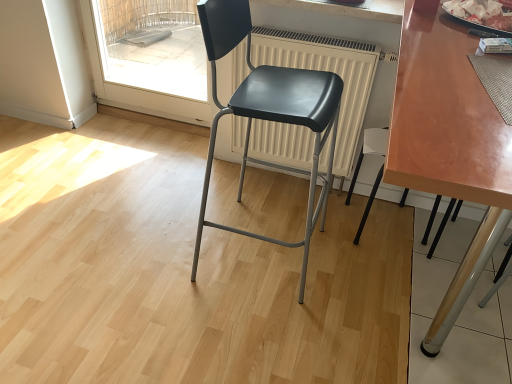
Question: Is matte black chair at center, which is the 1th chair in left-to-right order, at the back of matte black chair at lower right, which appears as the 2th chair when viewed from the left?

Choices:
 (A) no
 (B) yes

Answer: (A)

Question: Is matte black chair at lower right, which appears as the 2th chair when viewed from the left, bigger than matte black chair at center, which is the 1th chair in left-to-right order?

Choices:
 (A) yes
 (B) no

Answer: (B)

Question: Is matte black chair at lower right, marked as the 1th chair in a right-to-left arrangement, in contact with matte black chair at center, which is the 1th chair in left-to-right order?

Choices:
 (A) yes
 (B) no

Answer: (B)

Question: Is matte black chair at lower right, which appears as the 2th chair when viewed from the left, aimed at matte black chair at center, the second chair when ordered from right to left?

Choices:
 (A) yes
 (B) no

Answer: (B)

Question: From the image's perspective, is matte black chair at lower right, marked as the 1th chair in a right-to-left arrangement, below matte black chair at center, the second chair when ordered from right to left?

Choices:
 (A) no
 (B) yes

Answer: (B)

Question: Is matte black chair at lower right, marked as the 1th chair in a right-to-left arrangement, completely or partially outside of matte black chair at center, which is the 1th chair in left-to-right order?

Choices:
 (A) no
 (B) yes

Answer: (B)

Question: Is shiny silver tray at upper right wider than shiny brown table at center?

Choices:
 (A) yes
 (B) no

Answer: (B)

Question: Considering the relative positions of shiny silver tray at upper right and shiny brown table at center in the image provided, is shiny silver tray at upper right behind shiny brown table at center?

Choices:
 (A) yes
 (B) no

Answer: (A)

Question: Is shiny silver tray at upper right not inside shiny brown table at center?

Choices:
 (A) yes
 (B) no

Answer: (A)

Question: Is shiny silver tray at upper right shorter than shiny brown table at center?

Choices:
 (A) no
 (B) yes

Answer: (B)

Question: Considering the relative sizes of shiny silver tray at upper right and shiny brown table at center in the image provided, is shiny silver tray at upper right smaller than shiny brown table at center?

Choices:
 (A) yes
 (B) no

Answer: (A)

Question: Is shiny silver tray at upper right oriented towards shiny brown table at center?

Choices:
 (A) yes
 (B) no

Answer: (B)

Question: Is matte black chair at center, the second chair when ordered from right to left, in contact with white matte radiator at center?

Choices:
 (A) no
 (B) yes

Answer: (A)